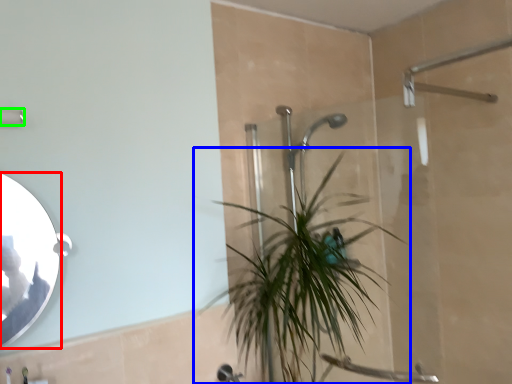
Question: Considering the real-world distances, which object is closest to mirror (highlighted by a red box)? houseplant (highlighted by a blue box) or shower (highlighted by a green box).

Choices:
 (A) houseplant
 (B) shower

Answer: (B)